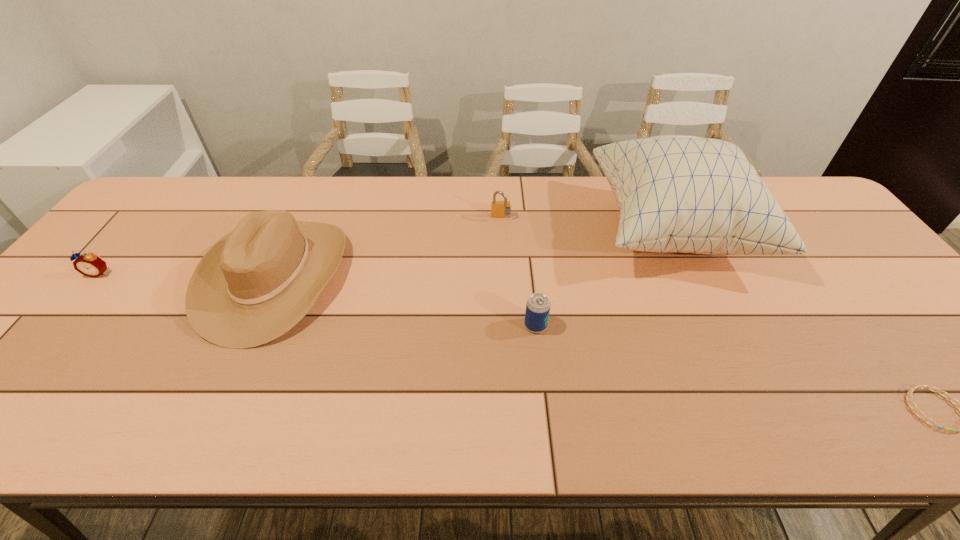
The image size is (960, 540). I want to click on cushion, so click(x=700, y=195).

Where is `the second object from right to left`? The image size is (960, 540). the second object from right to left is located at coordinates (700, 195).

The image size is (960, 540). I want to click on cowboy hat, so click(x=253, y=285).

Locate an element on the screen. the fifth shortest object is located at coordinates (253, 285).

Find the location of a particular element. This screenshot has width=960, height=540. padlock is located at coordinates (499, 209).

I want to click on beer can, so click(538, 305).

Where is `alarm clock`? This screenshot has width=960, height=540. alarm clock is located at coordinates (88, 264).

This screenshot has width=960, height=540. In order to click on free location located on the left of the fifth object from left to right in this screenshot , I will do `click(496, 230)`.

You are a GUI agent. You are given a task and a screenshot of the screen. Output one action in this format:
    pyautogui.click(x=<x>, y=<y>)
    Task: Click on the free space located 0.350m on the left of the cowboy hat
    The image size is (960, 540).
    Given the screenshot: What is the action you would take?
    pyautogui.click(x=75, y=276)

The width and height of the screenshot is (960, 540). What are the coordinates of `free point located 0.100m on the side with the combination dials of the fourth object from right to left` in the screenshot? It's located at (502, 244).